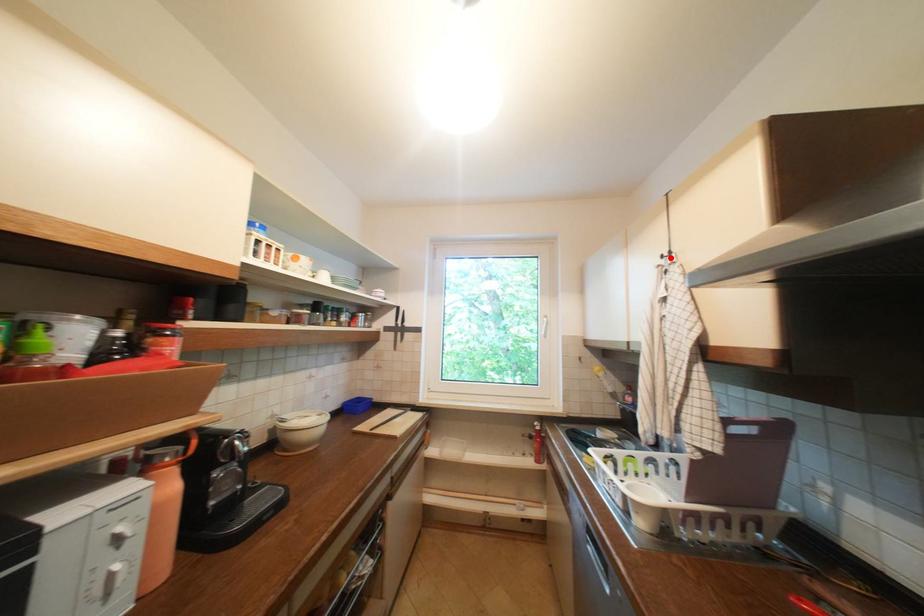
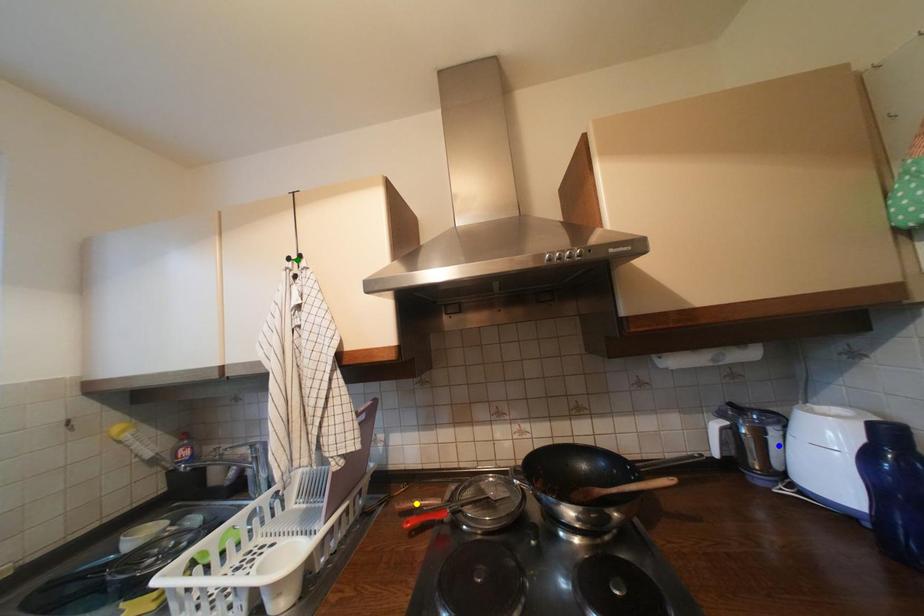
Question: I am providing you with two images of the same scene from different viewpoints. A red point is marked on the first image. You are given multiple points on the second image. Can you choose the point in image 2 that corresponds to the point in image 1?

Choices:
 (A) yellow point
 (B) green point
 (C) blue point

Answer: (B)